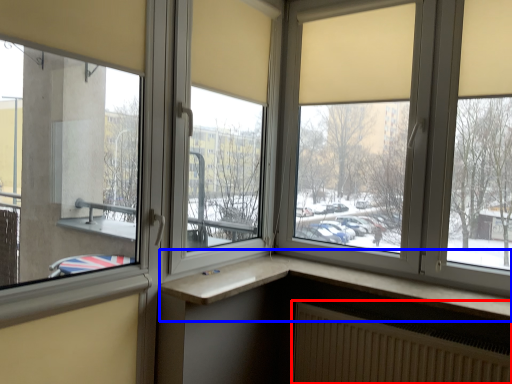
Question: Which object appears farthest to the camera in this image, radiator (highlighted by a red box) or window (highlighted by a blue box)?

Choices:
 (A) radiator
 (B) window

Answer: (B)